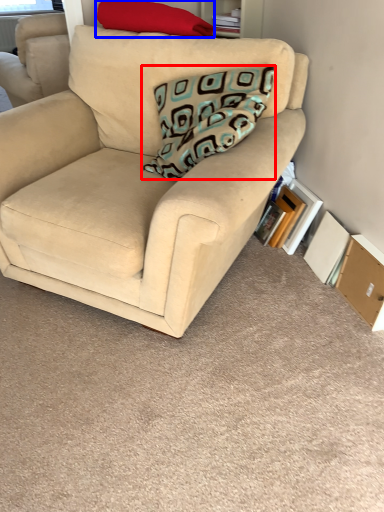
Question: Which point is closer to the camera, pillow (highlighted by a red box) or pillow (highlighted by a blue box)?

Choices:
 (A) pillow
 (B) pillow

Answer: (A)